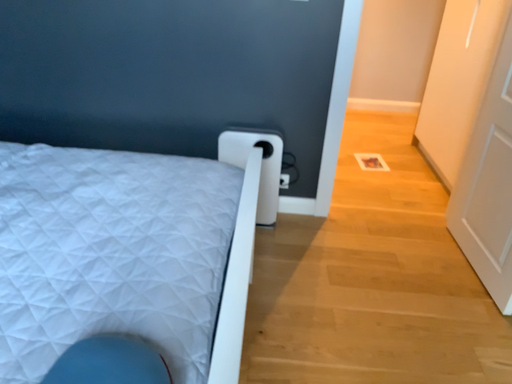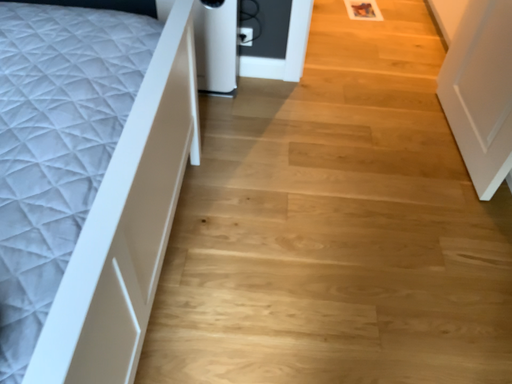
Question: Which way did the camera rotate in the video?

Choices:
 (A) rotated upward
 (B) rotated downward

Answer: (B)